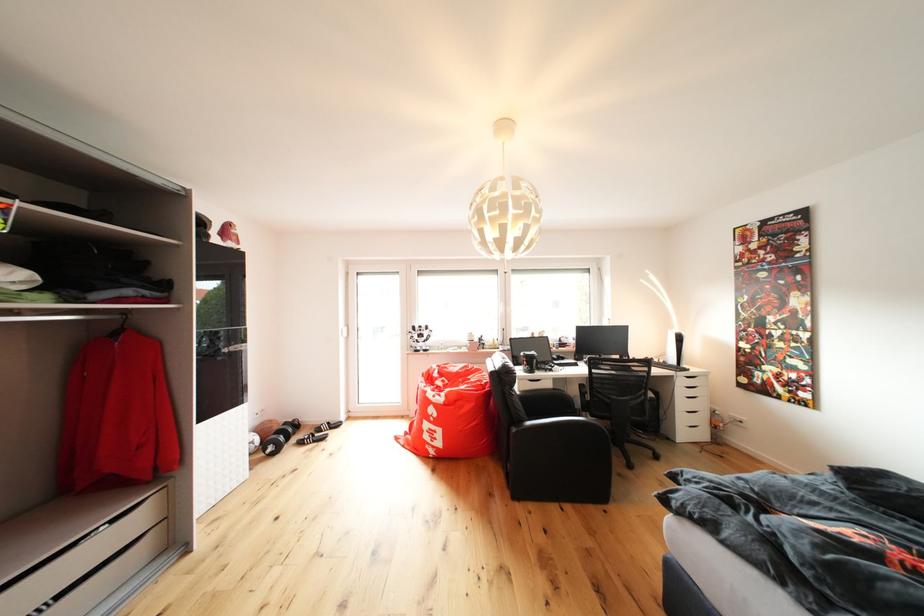
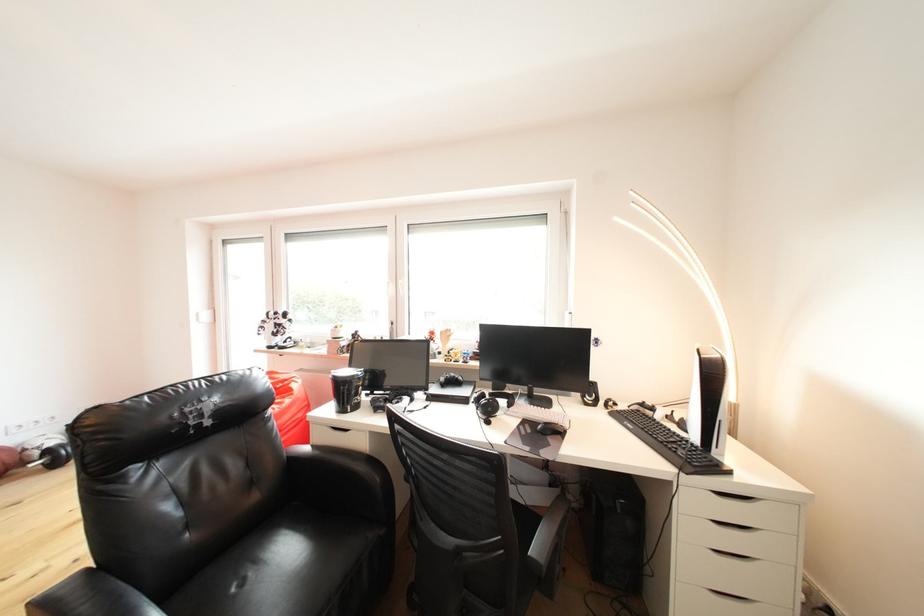
What movement of the cameraman would produce the second image?

The cameraman walked toward right, forward.